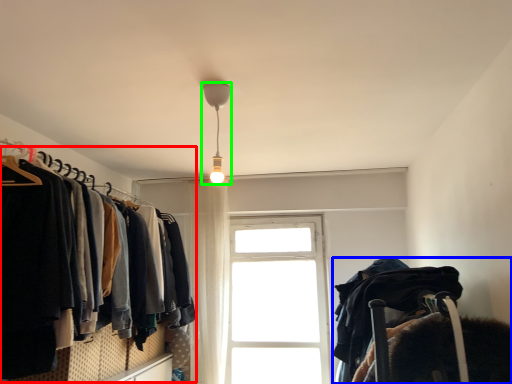
Question: Based on their relative distances, which object is nearer to closet (highlighted by a red box)? Choose from bunk bed (highlighted by a blue box) and lamp (highlighted by a green box).

Choices:
 (A) bunk bed
 (B) lamp

Answer: (B)